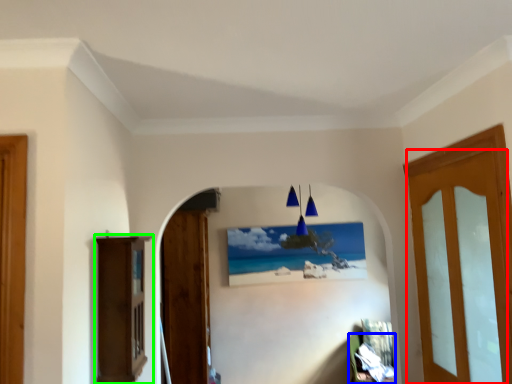
Question: Based on their relative distances, which object is farther from door (highlighted by a red box)? Choose from furniture (highlighted by a blue box) and furniture (highlighted by a green box).

Choices:
 (A) furniture
 (B) furniture

Answer: (A)